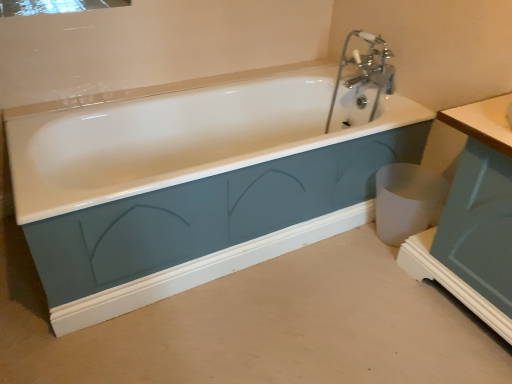
I want to click on vacant space positioned to the left of matte teal cabinet at right, so click(377, 301).